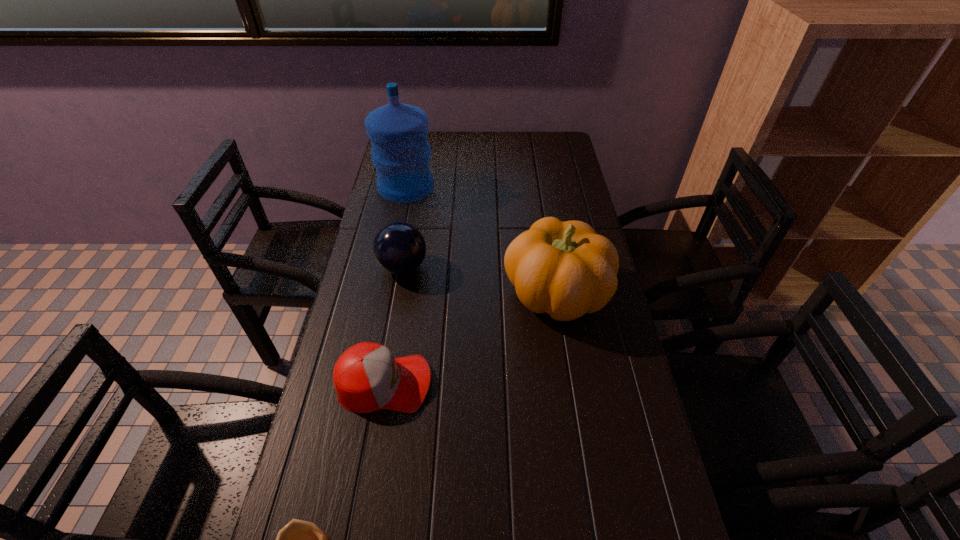
Where is `vacant space located 0.240m on the front-facing side of the shortest object`? The width and height of the screenshot is (960, 540). vacant space located 0.240m on the front-facing side of the shortest object is located at coordinates (532, 383).

Where is `water jug at the left edge`? water jug at the left edge is located at coordinates tap(401, 154).

Locate an element on the screen. The height and width of the screenshot is (540, 960). bowling ball at the left edge is located at coordinates 399,248.

You are a GUI agent. You are given a task and a screenshot of the screen. Output one action in this format:
    pyautogui.click(x=<x>, y=<y>)
    Task: Click on the baseball cap that is at the left edge
    The height and width of the screenshot is (540, 960).
    Given the screenshot: What is the action you would take?
    pyautogui.click(x=367, y=377)

At what (x,y) coordinates should I click in order to perform the action: click on object that is at the right edge. Please return your answer as a coordinate pair (x, y). The height and width of the screenshot is (540, 960). Looking at the image, I should click on (x=565, y=269).

Where is `vacant space at the far edge of the desktop`? Image resolution: width=960 pixels, height=540 pixels. vacant space at the far edge of the desktop is located at coordinates (481, 141).

Where is `vacant point at the left edge`? vacant point at the left edge is located at coordinates pyautogui.click(x=372, y=262).

You are a GUI agent. You are given a task and a screenshot of the screen. Output one action in this format:
    pyautogui.click(x=<x>, y=<y>)
    Task: Click on the free space at the right edge of the desktop
    The height and width of the screenshot is (540, 960).
    Given the screenshot: What is the action you would take?
    pyautogui.click(x=534, y=174)

Locate an element on the screen. free point between the third shortest object and the rightmost object is located at coordinates (480, 280).

The width and height of the screenshot is (960, 540). Find the location of `free space between the baseball cap and the pumpkin`. free space between the baseball cap and the pumpkin is located at coordinates (470, 338).